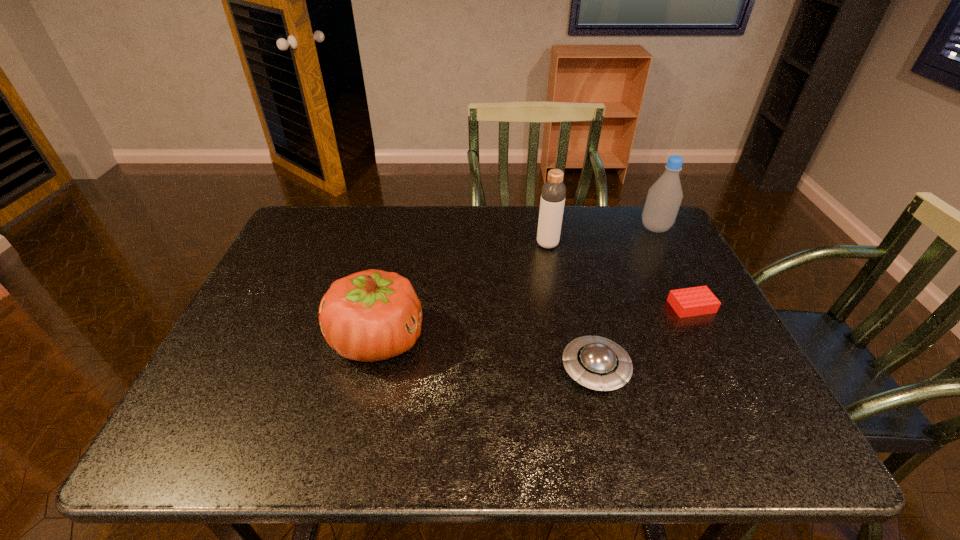
You are a GUI agent. You are given a task and a screenshot of the screen. Output one action in this format:
    pyautogui.click(x=<x>, y=<y>)
    Task: Click on the vacant region at the far left corner of the desktop
    The image size is (960, 540).
    Given the screenshot: What is the action you would take?
    pyautogui.click(x=333, y=241)

In the image, there is a desktop. Where is `vacant space at the near left corner`? The width and height of the screenshot is (960, 540). vacant space at the near left corner is located at coordinates (227, 426).

In the image, there is a desktop. Identify the location of free region at the far right corner. This screenshot has height=540, width=960. (624, 218).

You are a GUI agent. You are given a task and a screenshot of the screen. Output one action in this format:
    pyautogui.click(x=<x>, y=<y>)
    Task: Click on the unoccupied position between the right bottle and the shortest object
    This screenshot has width=960, height=540.
    Given the screenshot: What is the action you would take?
    pyautogui.click(x=673, y=267)

The height and width of the screenshot is (540, 960). Identify the location of vacant region between the nearer bottle and the pumpkin. (463, 292).

The height and width of the screenshot is (540, 960). I want to click on free space between the leftmost object and the saucer, so click(x=487, y=354).

Where is `free point between the Lego and the saucer`? free point between the Lego and the saucer is located at coordinates (643, 338).

What are the coordinates of `free space between the farther bottle and the nearer bottle` in the screenshot? It's located at (601, 236).

Where is `free spot between the farther bottle and the third tallest object`? The width and height of the screenshot is (960, 540). free spot between the farther bottle and the third tallest object is located at coordinates (516, 284).

This screenshot has height=540, width=960. I want to click on blank region between the farthest object and the saucer, so click(625, 299).